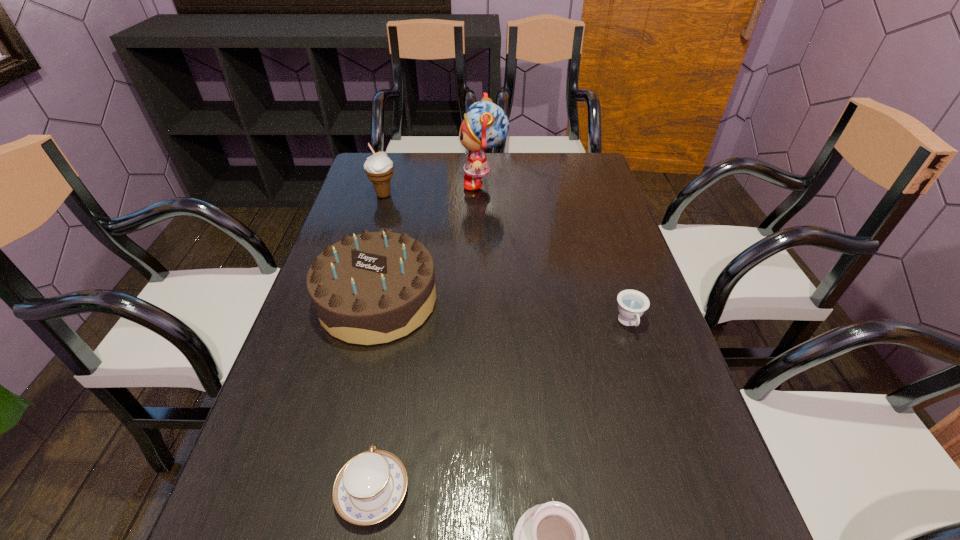
You are a GUI agent. You are given a task and a screenshot of the screen. Output one action in this format:
    pyautogui.click(x=<x>, y=<y>)
    Task: Click on the free space located 0.280m on the front-facing side of the birthday cake
    
    Given the screenshot: What is the action you would take?
    pyautogui.click(x=335, y=480)

Where is `free space located on the side of the farthest teacup with the handle`? This screenshot has width=960, height=540. free space located on the side of the farthest teacup with the handle is located at coordinates (681, 484).

Find the location of a particular element. vacant space positioned 0.260m on the side with the handle of the leftmost teacup is located at coordinates (398, 339).

The width and height of the screenshot is (960, 540). Identify the location of vacant region located 0.110m on the side with the handle of the leftmost teacup. (388, 400).

Locate an element on the screen. free spot located 0.080m on the side with the handle of the leftmost teacup is located at coordinates (386, 414).

What are the coordinates of `doll at the far edge` in the screenshot? It's located at (485, 125).

You are a GUI agent. You are given a task and a screenshot of the screen. Output one action in this format:
    pyautogui.click(x=<x>, y=<y>)
    Task: Click on the icecream that is at the far edge
    
    Given the screenshot: What is the action you would take?
    pyautogui.click(x=379, y=168)

The width and height of the screenshot is (960, 540). I want to click on icecream present at the left edge, so click(379, 168).

Locate an element on the screen. This screenshot has width=960, height=540. birthday cake that is at the left edge is located at coordinates (372, 288).

At what (x,y) coordinates should I click in order to perform the action: click on object that is at the right edge. Please return your answer as a coordinate pair (x, y). Looking at the image, I should click on (631, 303).